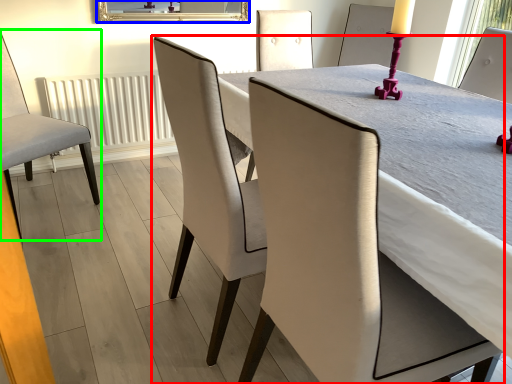
Question: Which object is the closest to the chair (highlighted by a red box)? Choose among these: mirror (highlighted by a blue box) or chair (highlighted by a green box).

Choices:
 (A) mirror
 (B) chair

Answer: (B)